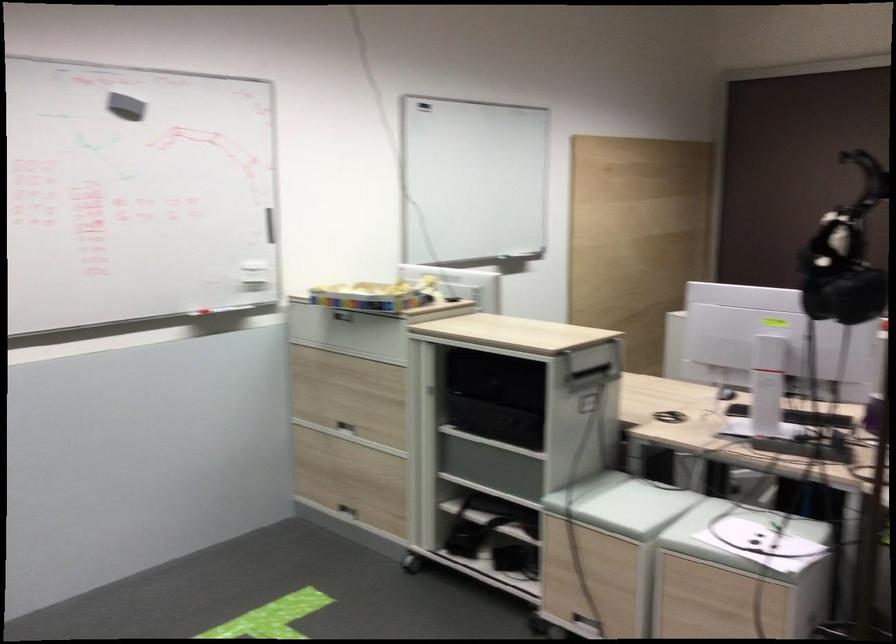
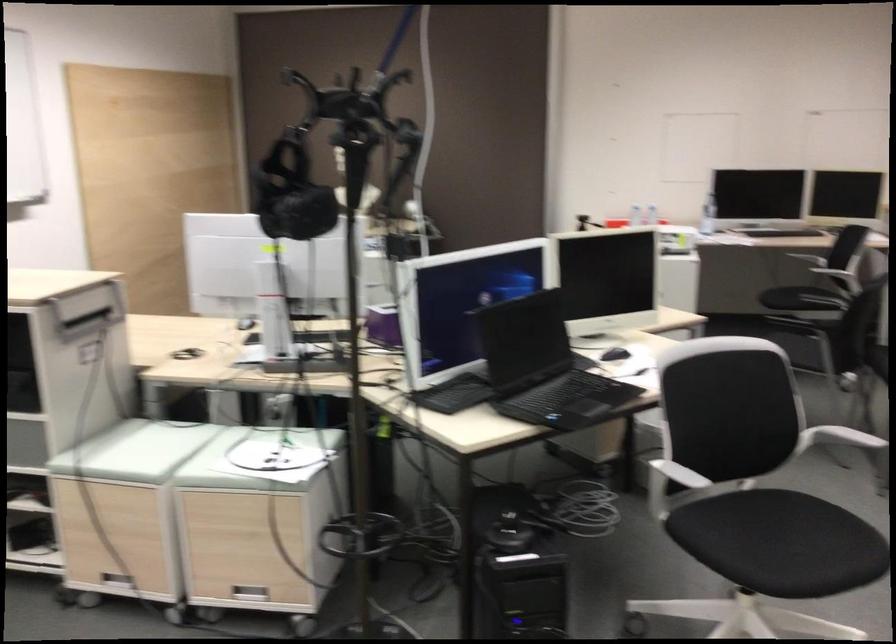
Question: The camera is either moving clockwise (left) or counter-clockwise (right) around the object. The first image is from the beginning of the video and the second image is from the end. Is the camera moving left or right when shooting the video?

Choices:
 (A) Left
 (B) Right

Answer: (A)